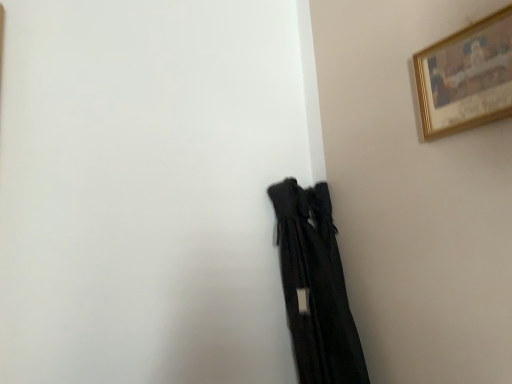
Describe the element at coordinates (466, 79) in the screenshot. I see `gold-framed picture at upper right` at that location.

Where is `gold-framed picture at upper right`? gold-framed picture at upper right is located at coordinates (466, 79).

You are a GUI agent. You are given a task and a screenshot of the screen. Output one action in this format:
    pyautogui.click(x=<x>, y=<y>)
    Task: Click on the gold-framed picture at upper right
    The height and width of the screenshot is (384, 512).
    Given the screenshot: What is the action you would take?
    pyautogui.click(x=466, y=79)